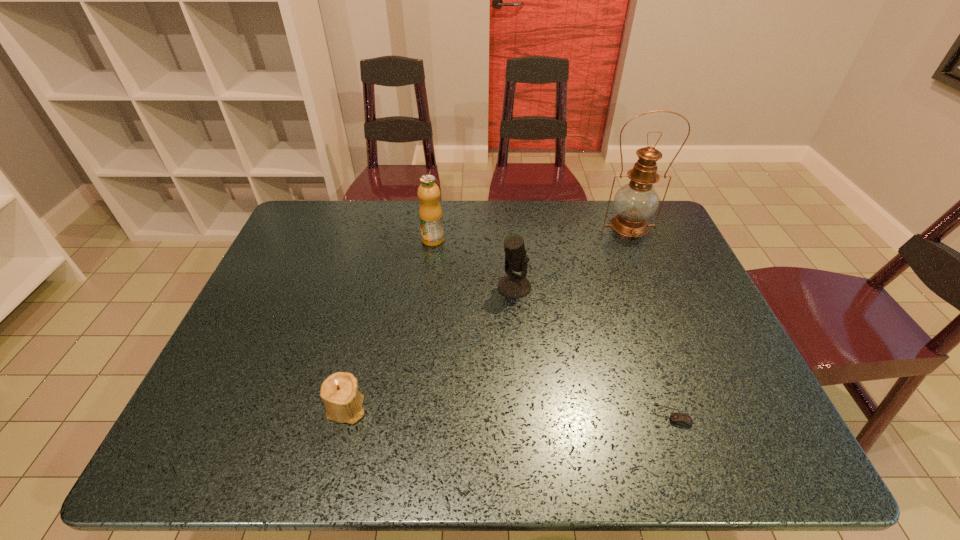
This screenshot has width=960, height=540. In the image, there is a desktop. In order to click on vacant area at the left edge in this screenshot , I will do `click(283, 257)`.

I want to click on vacant space at the right edge of the desktop, so click(x=681, y=258).

Where is `vacant space at the near right corner`? This screenshot has width=960, height=540. vacant space at the near right corner is located at coordinates (771, 445).

The image size is (960, 540). What are the coordinates of `free space between the leftmost object and the mouse` in the screenshot? It's located at (509, 411).

You are a GUI agent. You are given a task and a screenshot of the screen. Output one action in this format:
    pyautogui.click(x=<x>, y=<y>)
    Task: Click on the blank region between the microphone and the mouse
    
    Given the screenshot: What is the action you would take?
    pyautogui.click(x=593, y=350)

Identify the location of vacant area between the oil lamp and the third nearest object. The height and width of the screenshot is (540, 960). click(572, 256).

Image resolution: width=960 pixels, height=540 pixels. I want to click on free space between the shortest object and the second tallest object, so click(552, 327).

This screenshot has height=540, width=960. Identify the location of vacant point located between the fourth object from right to left and the shortest object. (552, 327).

Locate an element on the screen. The image size is (960, 540). vacant space that's between the shortest object and the oil lamp is located at coordinates (651, 320).

Where is `vacant region between the second shortest object and the tallest object`? This screenshot has height=540, width=960. vacant region between the second shortest object and the tallest object is located at coordinates (488, 317).